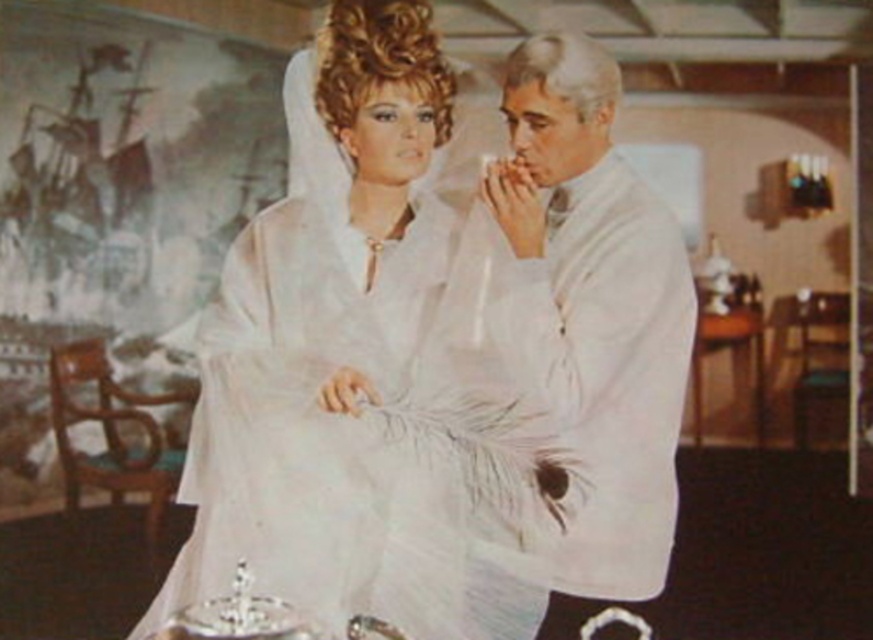
Question: Is white satin dress at center positioned before white matte coat at center?

Choices:
 (A) no
 (B) yes

Answer: (B)

Question: Which point is farther from the camera taking this photo?

Choices:
 (A) (654, 512)
 (B) (272, 378)

Answer: (A)

Question: Is white satin dress at center to the right of white matte coat at center from the viewer's perspective?

Choices:
 (A) no
 (B) yes

Answer: (A)

Question: Among these points, which one is farthest from the camera?

Choices:
 (A) (394, 205)
 (B) (561, 570)

Answer: (B)

Question: Is white satin dress at center wider than white matte coat at center?

Choices:
 (A) yes
 (B) no

Answer: (A)

Question: Which point is closer to the camera?

Choices:
 (A) white matte coat at center
 (B) white satin dress at center

Answer: (B)